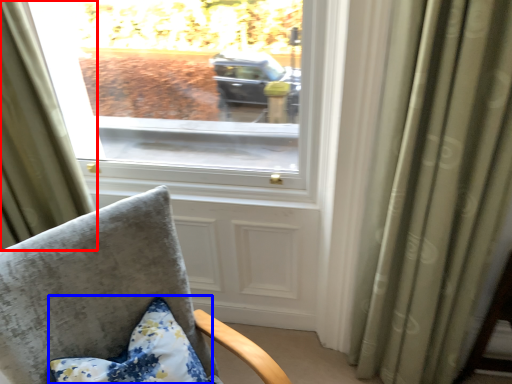
Question: Which of the following is the closest to the observer, curtain (highlighted by a red box) or pillow (highlighted by a blue box)?

Choices:
 (A) curtain
 (B) pillow

Answer: (B)